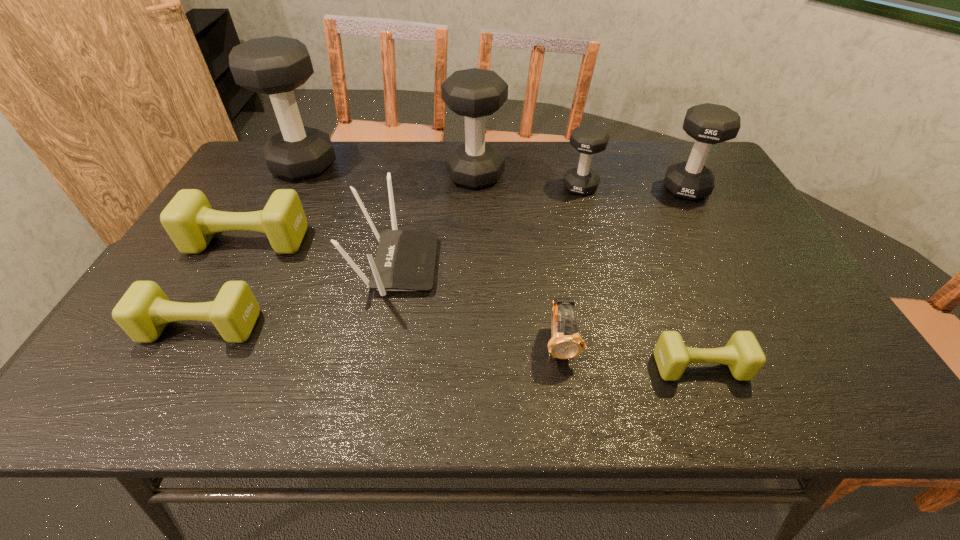
You are a GUI agent. You are given a task and a screenshot of the screen. Output one action in this format:
    pyautogui.click(x=<x>, y=<y>)
    Task: Click on the third nearest dumbbell
    
    Given the screenshot: What is the action you would take?
    pyautogui.click(x=189, y=220)

This screenshot has height=540, width=960. In order to click on gold watch in this screenshot , I will do `click(565, 343)`.

You are a GUI agent. You are given a task and a screenshot of the screen. Output one action in this format:
    pyautogui.click(x=<x>, y=<y>)
    Task: Click on the sixth object from left to right
    This screenshot has height=540, width=960.
    Given the screenshot: What is the action you would take?
    pyautogui.click(x=565, y=343)

At what (x,y) coordinates should I click in order to perform the action: click on the sixth tallest dumbbell. Please return your answer as a coordinate pair (x, y). Image resolution: width=960 pixels, height=540 pixels. Looking at the image, I should click on pyautogui.click(x=144, y=311).

Locate an element on the screen. Image resolution: width=960 pixels, height=540 pixels. the sixth farthest dumbbell is located at coordinates (144, 311).

The image size is (960, 540). In order to click on the nearest olive dumbbell in this screenshot , I will do `click(743, 355)`.

Identify the location of the shortest dumbbell. Image resolution: width=960 pixels, height=540 pixels. pyautogui.click(x=743, y=355).

The image size is (960, 540). I want to click on free region located on the right of the leftmost gray dumbbell, so click(x=356, y=165).

Where is `vacant space located on the right of the third smallest gray dumbbell`? vacant space located on the right of the third smallest gray dumbbell is located at coordinates (527, 175).

Locate an element on the screen. This screenshot has width=960, height=540. free point located on the left of the fifth shortest dumbbell is located at coordinates (565, 188).